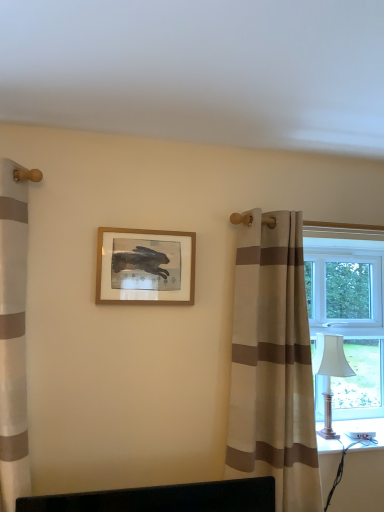
Question: Can you see wooden picture frame at center touching beige striped curtain at right?

Choices:
 (A) yes
 (B) no

Answer: (B)

Question: Is wooden picture frame at center aimed at beige striped curtain at right?

Choices:
 (A) yes
 (B) no

Answer: (B)

Question: From the image's perspective, is wooden picture frame at center on top of beige striped curtain at right?

Choices:
 (A) yes
 (B) no

Answer: (A)

Question: Can you confirm if wooden picture frame at center is wider than beige striped curtain at right?

Choices:
 (A) no
 (B) yes

Answer: (A)

Question: Is wooden picture frame at center positioned with its back to beige striped curtain at right?

Choices:
 (A) yes
 (B) no

Answer: (B)

Question: From a real-world perspective, relative to silver metallic table lamp at right, is wooden picture frame at center vertically above or below?

Choices:
 (A) below
 (B) above

Answer: (B)

Question: Is wooden picture frame at center wider or thinner than silver metallic table lamp at right?

Choices:
 (A) wide
 (B) thin

Answer: (B)

Question: Is wooden picture frame at center spatially inside silver metallic table lamp at right, or outside of it?

Choices:
 (A) inside
 (B) outside

Answer: (B)

Question: In the image, is wooden picture frame at center on the left side or the right side of silver metallic table lamp at right?

Choices:
 (A) left
 (B) right

Answer: (A)

Question: Is wooden picture frame at center wider or thinner than white plastic window at right?

Choices:
 (A) thin
 (B) wide

Answer: (A)

Question: Considering the positions of wooden picture frame at center and white plastic window at right in the image, is wooden picture frame at center taller or shorter than white plastic window at right?

Choices:
 (A) short
 (B) tall

Answer: (A)

Question: In the image, is wooden picture frame at center positioned in front of or behind white plastic window at right?

Choices:
 (A) behind
 (B) front

Answer: (B)

Question: Considering the positions of point pyautogui.click(x=188, y=244) and point pyautogui.click(x=372, y=264), is point pyautogui.click(x=188, y=244) closer or farther from the camera than point pyautogui.click(x=372, y=264)?

Choices:
 (A) closer
 (B) farther

Answer: (A)

Question: From the image's perspective, is silver metallic table lamp at right above or below white plastic window at right?

Choices:
 (A) below
 (B) above

Answer: (A)

Question: Does point (327, 415) appear closer or farther from the camera than point (372, 309)?

Choices:
 (A) farther
 (B) closer

Answer: (B)